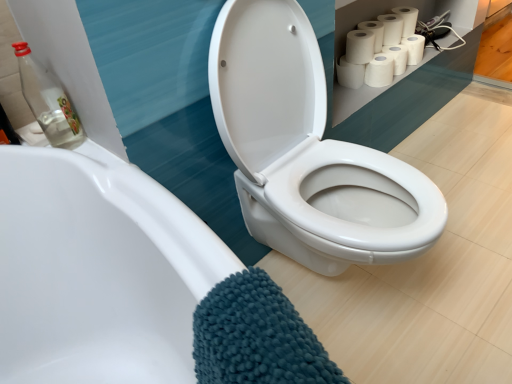
The width and height of the screenshot is (512, 384). Find the location of `vacant area that lies in front of white matte toilet paper at upper right, positioned as the 7th toilet paper in right-to-left order`. vacant area that lies in front of white matte toilet paper at upper right, positioned as the 7th toilet paper in right-to-left order is located at coordinates (350, 91).